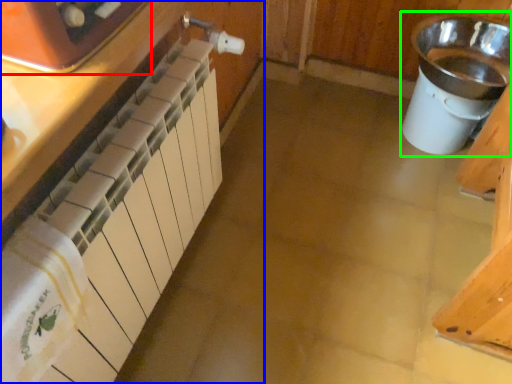
Question: Which is nearer to the home appliance (highlighted by a red box)? cabinetry (highlighted by a blue box) or sink (highlighted by a green box).

Choices:
 (A) cabinetry
 (B) sink

Answer: (A)